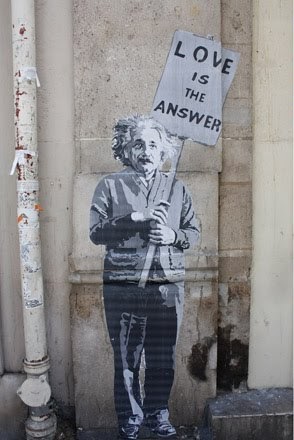
The width and height of the screenshot is (294, 440). Find the location of `wall`. wall is located at coordinates (62, 29).